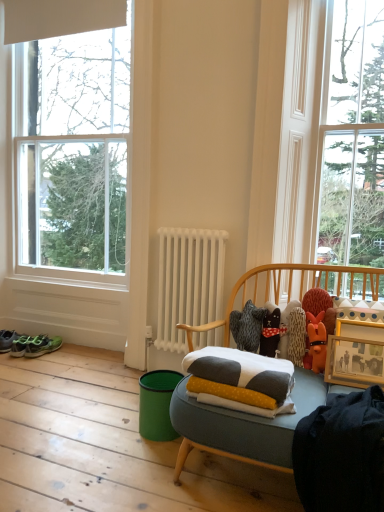
Question: Is soft cotton pillow at center positioned with its back to clear glass window at upper right, the second window in the left-to-right sequence?

Choices:
 (A) no
 (B) yes

Answer: (A)

Question: Would you say soft cotton pillow at center contains clear glass window at upper right, the first window positioned from the right?

Choices:
 (A) no
 (B) yes

Answer: (A)

Question: Does soft cotton pillow at center have a greater width compared to clear glass window at upper right, the first window positioned from the right?

Choices:
 (A) no
 (B) yes

Answer: (B)

Question: Does soft cotton pillow at center have a smaller size compared to clear glass window at upper right, the second window in the left-to-right sequence?

Choices:
 (A) yes
 (B) no

Answer: (A)

Question: Is soft cotton pillow at center placed right next to clear glass window at upper right, the second window in the left-to-right sequence?

Choices:
 (A) yes
 (B) no

Answer: (B)

Question: Does soft cotton pillow at center have a greater height compared to clear glass window at upper right, the first window positioned from the right?

Choices:
 (A) no
 (B) yes

Answer: (A)

Question: Can you confirm if green matte running shoe at lower left is bigger than white frame window at left, placed as the second window when sorted from right to left?

Choices:
 (A) no
 (B) yes

Answer: (A)

Question: Is green matte running shoe at lower left further to the viewer compared to white frame window at left, the 1th window from the left?

Choices:
 (A) yes
 (B) no

Answer: (A)

Question: Can white frame window at left, the 1th window from the left, be found inside green matte running shoe at lower left?

Choices:
 (A) yes
 (B) no

Answer: (B)

Question: Is green matte running shoe at lower left wider than white frame window at left, the 1th window from the left?

Choices:
 (A) no
 (B) yes

Answer: (B)

Question: Does green matte running shoe at lower left have a greater height compared to white frame window at left, the 1th window from the left?

Choices:
 (A) yes
 (B) no

Answer: (B)

Question: Is green matte running shoe at lower left with white frame window at left, the 1th window from the left?

Choices:
 (A) yes
 (B) no

Answer: (B)

Question: Is the position of clear glass window at upper right, the second window in the left-to-right sequence, less distant than that of white frame window at left, the 1th window from the left?

Choices:
 (A) no
 (B) yes

Answer: (B)